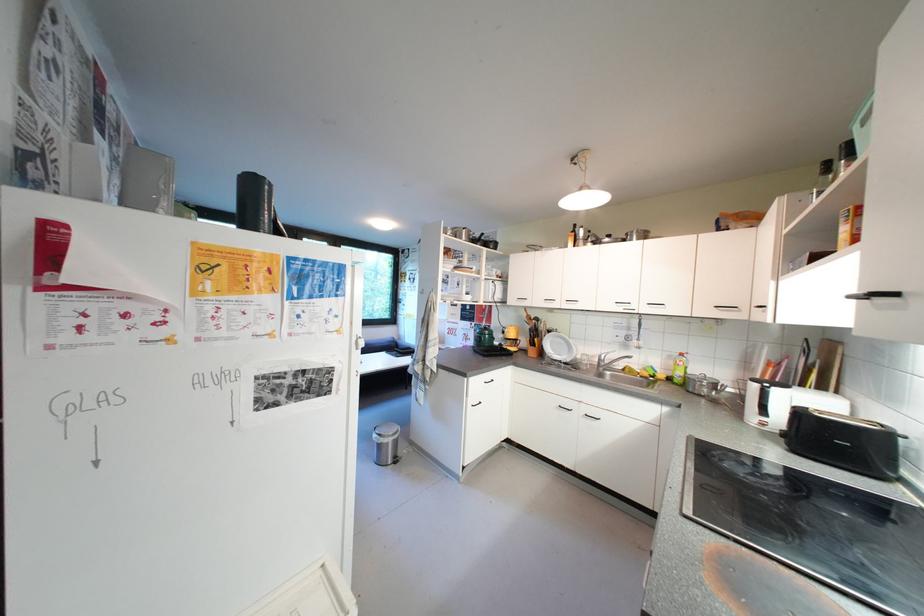
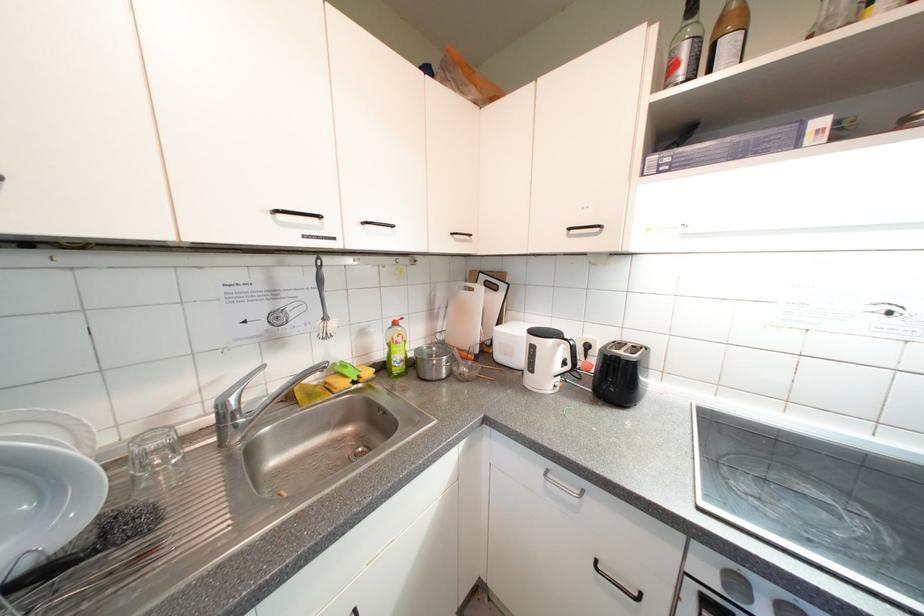
Locate, in the second image, the point that corresponds to the point at 608,362 in the first image.

(233, 419)